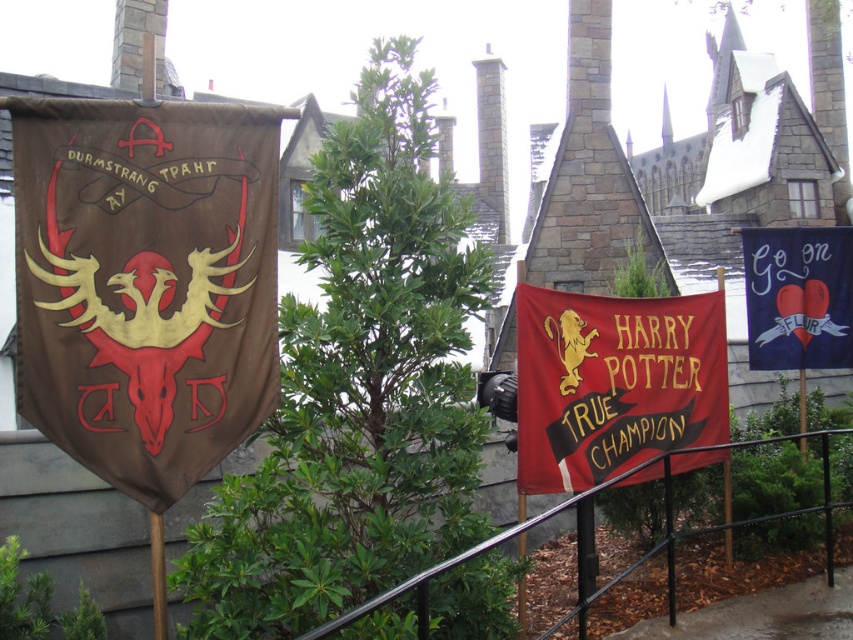
You are standing in a themed Harry Potter area and notice three banners. The banners are described as follows from left to right in the foreground. The first is brown with a phoenix and skull, the second is red with a lion and the text about Harry Potter, and the third is the navy blue fabric banner at upper right. Based on their positions, which banner is positioned higher up in the image?

The navy blue fabric banner at upper right is located at point [798,296], which means it is higher up compared to the other banners in the scene.

Looking at this image, you are organizing a Harry Potter themed event and need to place a new banner that is 2 meters wide. You have space between the brown leather banner at left and the black metal fence at lower center. Will the new banner fit in that space?

The brown leather banner at left is narrower than the black metal fence at lower center, so the space between them may be sufficient to accommodate a 2 meter wide banner. However, since the exact distance isn not provided, it is recommended to measure the available space before placing the new banner.

You are a guest at a Harry Potter themed event and want to take a photo with the brown leather banner at left and the black metal fence at lower center. Which object should you stand closer to in order to capture both in your photo frame?

Since the brown leather banner at left is smaller in size compared to the black metal fence at lower center, you should stand closer to the brown leather banner at left to ensure both objects are visible in the photo frame.